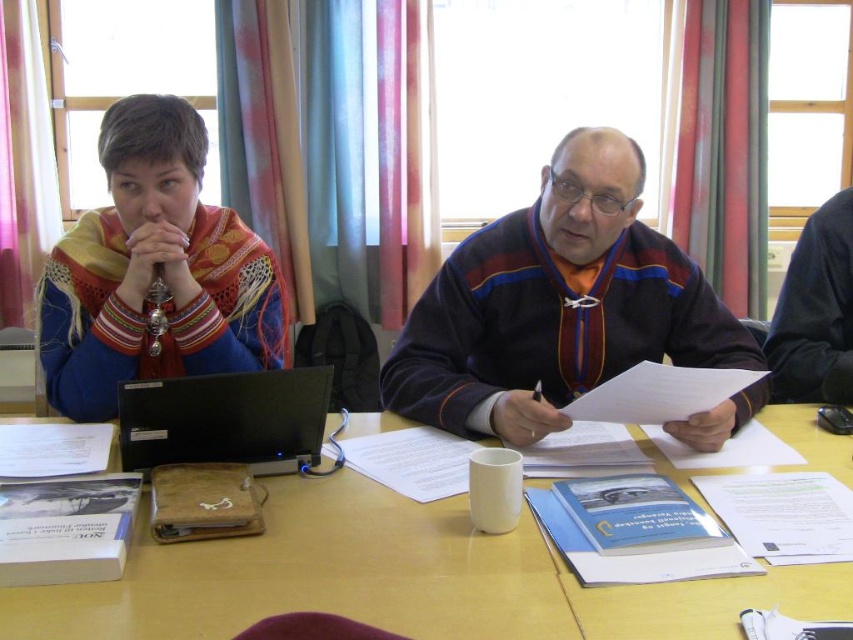
You are a delivery person who needs to place a small package on the table without covering any existing items. The table has a coordinate system where the bottom left corner is the origin. The package must be placed at coordinates between 0.4 and 0.6 in both x and y. Can you place the package at the same position as the matte black sweater at center?

The matte black sweater at center is located at point (556, 305), which falls within the required x and y coordinates of 0.4 to 0.6. Therefore, you can place the package at the same position as the matte black sweater at center.

You are standing in the room where the two people are sitting at the wooden table at center. You want to place a small vase on the table. Is there enough space at point [396,580] to place the vase?

The wooden table at center has an object at point [396,580], so there is no space to place the vase there.

You are a guest at this meeting and want to place a small notebook on the wooden table at center without covering the matte multicolored scarf at left. Is this possible?

The wooden table at center is below the matte multicolored scarf at left, so placing the notebook on the table won t cover the scarf since they are at different vertical positions.